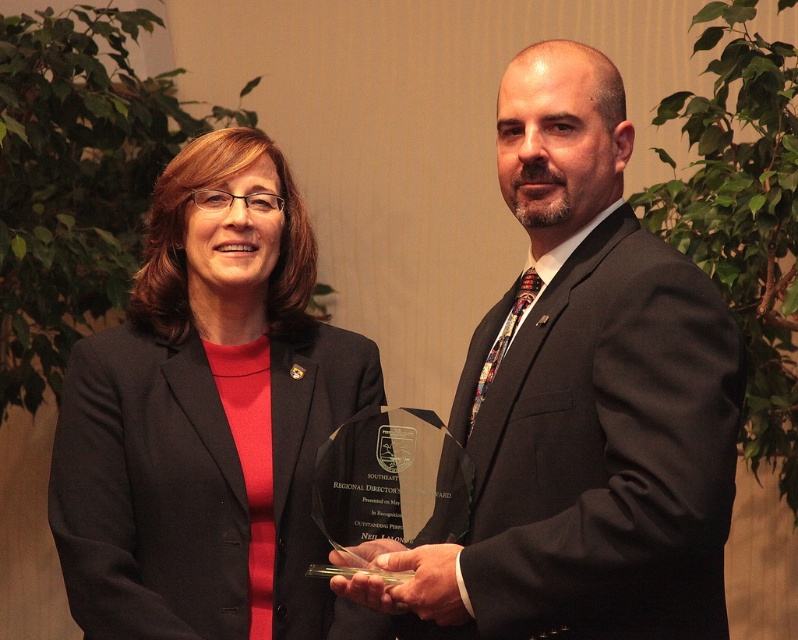
Does matte black suit at center have a greater height compared to matte black blazer at center?

Yes.

Between matte black suit at center and matte black blazer at center, which one is positioned higher?

Positioned higher is matte black suit at center.

Locate an element on the screen. matte black suit at center is located at coordinates (583, 401).